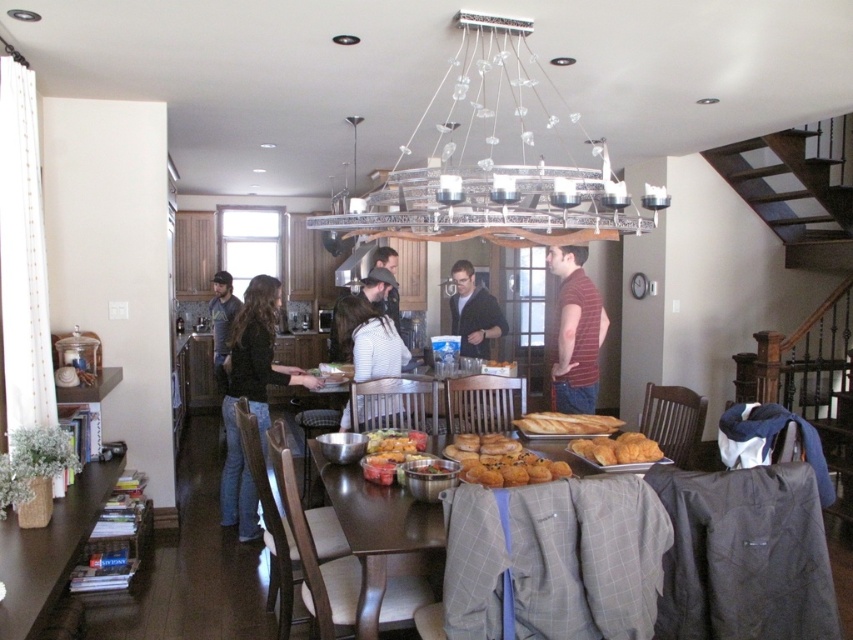
Which is more to the left, striped cotton shirt at center or dark blue jeans at center?

dark blue jeans at center

Between striped cotton shirt at center and dark blue jeans at center, which one is positioned lower?

striped cotton shirt at center is below.

Is point (402, 358) in front of point (225, 384)?

Yes, point (402, 358) is closer to viewer.

At what (x,y) coordinates should I click in order to perform the action: click on striped cotton shirt at center. Please return your answer as a coordinate pair (x, y). Image resolution: width=853 pixels, height=640 pixels. Looking at the image, I should click on (370, 339).

Is wooden table at center wider than dark gray sweater at center?

Yes.

Which is more to the right, wooden table at center or dark gray sweater at center?

dark gray sweater at center

Does point (767, 605) come closer to viewer compared to point (485, 356)?

Yes, point (767, 605) is in front of point (485, 356).

This screenshot has width=853, height=640. Identify the location of wooden table at center. tap(645, 557).

Is point (485, 324) more distant than point (421, 451)?

Yes.

Based on the photo, which is above, dark gray sweater at center or shiny metallic bowls at center?

dark gray sweater at center is higher up.

Image resolution: width=853 pixels, height=640 pixels. What do you see at coordinates (473, 312) in the screenshot? I see `dark gray sweater at center` at bounding box center [473, 312].

At what (x,y) coordinates should I click in order to perform the action: click on dark gray sweater at center. Please return your answer as a coordinate pair (x, y). This screenshot has width=853, height=640. Looking at the image, I should click on (473, 312).